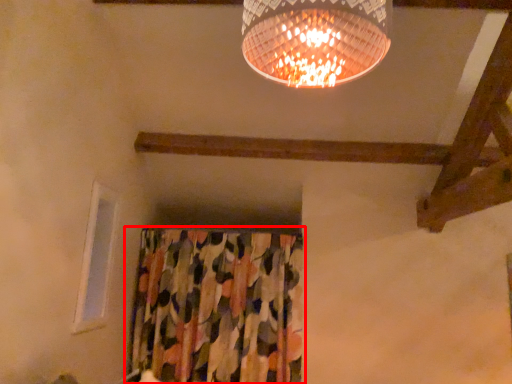
Question: From the image's perspective, where is curtain (annotated by the red box) located in relation to window in the image?

Choices:
 (A) below
 (B) above

Answer: (A)